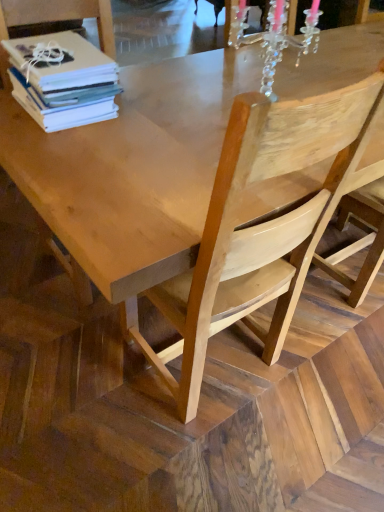
Where is `free space in front of natural wood chair at center, the second chair when ordered from left to right`? Image resolution: width=384 pixels, height=512 pixels. free space in front of natural wood chair at center, the second chair when ordered from left to right is located at coordinates (190, 461).